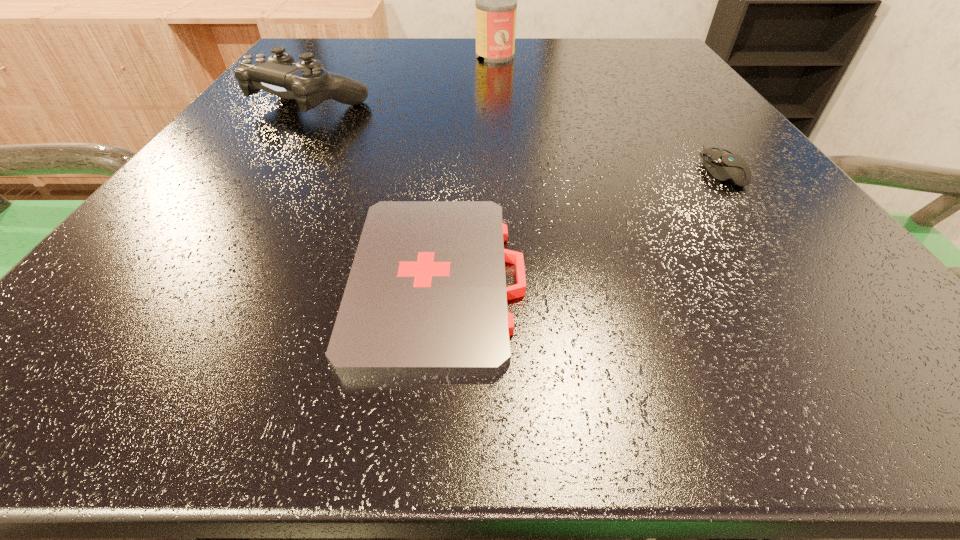
Identify the location of empty space between the third nearest object and the rightmost object. The width and height of the screenshot is (960, 540). (516, 136).

I want to click on vacant region between the control and the third farthest object, so click(516, 136).

Where is `vacant point located between the nearest object and the can`? The height and width of the screenshot is (540, 960). vacant point located between the nearest object and the can is located at coordinates click(467, 167).

Locate an element on the screen. free space between the control and the first-aid kit is located at coordinates (374, 191).

The width and height of the screenshot is (960, 540). I want to click on vacant region between the nearest object and the second farthest object, so click(x=374, y=191).

I want to click on free space between the farthest object and the control, so click(403, 79).

Locate an element on the screen. This screenshot has width=960, height=540. empty location between the leftmost object and the tallest object is located at coordinates 403,79.

Where is `vacant space in between the nearest object and the rightmost object`? This screenshot has height=540, width=960. vacant space in between the nearest object and the rightmost object is located at coordinates [x=580, y=223].

You are a GUI agent. You are given a task and a screenshot of the screen. Output one action in this format:
    pyautogui.click(x=<x>, y=<y>)
    Task: Click on the unoccupied area between the first-aid kit and the second shortest object
    The height and width of the screenshot is (540, 960).
    Given the screenshot: What is the action you would take?
    click(580, 223)

Locate an element on the screen. This screenshot has width=960, height=540. free point between the second shortest object and the control is located at coordinates (516, 136).